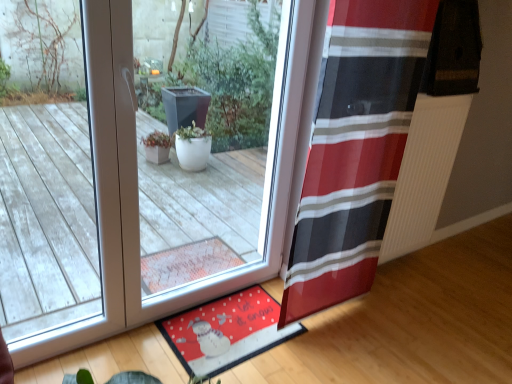
Question: Considering the positions of transparent glass window at center and red striped curtain at right in the image, is transparent glass window at center wider or thinner than red striped curtain at right?

Choices:
 (A) wide
 (B) thin

Answer: (A)

Question: Considering the positions of transparent glass window at center and red striped curtain at right in the image, is transparent glass window at center bigger or smaller than red striped curtain at right?

Choices:
 (A) big
 (B) small

Answer: (A)

Question: Based on their relative distances, which object is nearer to the red striped curtain at right?

Choices:
 (A) transparent glass window at center
 (B) red fabric mat at lower center

Answer: (B)

Question: Which object is positioned farthest from the red striped curtain at right?

Choices:
 (A) red fabric mat at lower center
 (B) transparent glass window at center

Answer: (B)